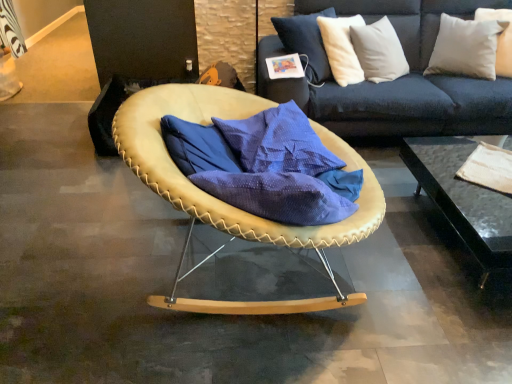
Where is `white soft pillow at upper right, the 1th pillow viewed from the right`? white soft pillow at upper right, the 1th pillow viewed from the right is located at coordinates (500, 38).

What do you see at coordinates (466, 47) in the screenshot?
I see `white cotton pillow at upper right, arranged as the first pillow when viewed from the left` at bounding box center [466, 47].

Locate an element on the screen. This screenshot has height=384, width=512. black glass table at lower right is located at coordinates (463, 199).

Where is `chair located on the left of white soft pillow at upper right, placed as the 2th pillow when sorted from left to right`? The height and width of the screenshot is (384, 512). chair located on the left of white soft pillow at upper right, placed as the 2th pillow when sorted from left to right is located at coordinates (228, 204).

Is white soft pillow at upper right, the 1th pillow viewed from the right, shorter than leather-like tan chair at center?

Indeed, white soft pillow at upper right, the 1th pillow viewed from the right, has a lesser height compared to leather-like tan chair at center.

Is white soft pillow at upper right, placed as the 2th pillow when sorted from left to right, oriented away from leather-like tan chair at center?

white soft pillow at upper right, placed as the 2th pillow when sorted from left to right, does not have its back to leather-like tan chair at center.

Would you say leather-like tan chair at center is part of white soft pillow at upper right, placed as the 2th pillow when sorted from left to right,'s contents?

No.

From a real-world perspective, is white soft pillow at upper right, the 1th pillow viewed from the right, over black glass table at lower right?

Yes, from a real-world perspective, white soft pillow at upper right, the 1th pillow viewed from the right, is on top of black glass table at lower right.

Is white soft pillow at upper right, placed as the 2th pillow when sorted from left to right, shorter than black glass table at lower right?

Incorrect, the height of white soft pillow at upper right, placed as the 2th pillow when sorted from left to right, does not fall short of that of black glass table at lower right.

Considering the positions of objects white soft pillow at upper right, placed as the 2th pillow when sorted from left to right, and black glass table at lower right in the image provided, who is more to the left, white soft pillow at upper right, placed as the 2th pillow when sorted from left to right, or black glass table at lower right?

black glass table at lower right is more to the left.

Considering the points (484, 11) and (501, 251), which point is behind, point (484, 11) or point (501, 251)?

The point (484, 11) is farther.

Does white soft pillow at upper right, the 1th pillow viewed from the right, have a smaller size compared to white cotton pillow at upper right, arranged as the 2th pillow when viewed from the right?

Correct, white soft pillow at upper right, the 1th pillow viewed from the right, occupies less space than white cotton pillow at upper right, arranged as the 2th pillow when viewed from the right.

From the image's perspective, who appears lower, white soft pillow at upper right, the 1th pillow viewed from the right, or white cotton pillow at upper right, arranged as the 2th pillow when viewed from the right?

From the image's view, white cotton pillow at upper right, arranged as the 2th pillow when viewed from the right, is below.

Which object is wider, white soft pillow at upper right, the 1th pillow viewed from the right, or white cotton pillow at upper right, arranged as the 2th pillow when viewed from the right?

white soft pillow at upper right, the 1th pillow viewed from the right.

Measure the distance from white soft pillow at upper right, placed as the 2th pillow when sorted from left to right, to white cotton pillow at upper right, arranged as the 2th pillow when viewed from the right.

white soft pillow at upper right, placed as the 2th pillow when sorted from left to right, is 7.39 inches from white cotton pillow at upper right, arranged as the 2th pillow when viewed from the right.

How different are the orientations of leather-like tan chair at center and white cotton pillow at upper right, arranged as the 2th pillow when viewed from the right, in degrees?

The facing directions of leather-like tan chair at center and white cotton pillow at upper right, arranged as the 2th pillow when viewed from the right, are 130 degrees apart.

From the picture: Considering the sizes of leather-like tan chair at center and white cotton pillow at upper right, arranged as the first pillow when viewed from the left, in the image, is leather-like tan chair at center wider or thinner than white cotton pillow at upper right, arranged as the first pillow when viewed from the left,?

In the image, leather-like tan chair at center appears to be wider than white cotton pillow at upper right, arranged as the first pillow when viewed from the left.

Considering the sizes of objects leather-like tan chair at center and white cotton pillow at upper right, arranged as the first pillow when viewed from the left, in the image provided, who is smaller, leather-like tan chair at center or white cotton pillow at upper right, arranged as the first pillow when viewed from the left,?

white cotton pillow at upper right, arranged as the first pillow when viewed from the left, is smaller.

Which of these two, black glass table at lower right or leather-like tan chair at center, is thinner?

leather-like tan chair at center is thinner.

Is leather-like tan chair at center surrounded by black glass table at lower right?

No, leather-like tan chair at center is not surrounded by black glass table at lower right.

Which of these two, black glass table at lower right or leather-like tan chair at center, stands shorter?

With less height is black glass table at lower right.

From a real-world perspective, is white cotton pillow at upper right, arranged as the 2th pillow when viewed from the right, physically located above or below leather-like tan chair at center?

From a real-world perspective, white cotton pillow at upper right, arranged as the 2th pillow when viewed from the right, is physically above leather-like tan chair at center.

Locate an element on the screen. chair that is under the white cotton pillow at upper right, arranged as the first pillow when viewed from the left (from a real-world perspective) is located at coordinates (228, 204).

Looking at this image, considering the relative sizes of white cotton pillow at upper right, arranged as the 2th pillow when viewed from the right, and leather-like tan chair at center in the image provided, is white cotton pillow at upper right, arranged as the 2th pillow when viewed from the right, shorter than leather-like tan chair at center?

Indeed, white cotton pillow at upper right, arranged as the 2th pillow when viewed from the right, has a lesser height compared to leather-like tan chair at center.

Is white cotton pillow at upper right, arranged as the first pillow when viewed from the left, thinner than white soft pillow at upper right, placed as the 2th pillow when sorted from left to right?

Correct, the width of white cotton pillow at upper right, arranged as the first pillow when viewed from the left, is less than that of white soft pillow at upper right, placed as the 2th pillow when sorted from left to right.

Is white cotton pillow at upper right, arranged as the 2th pillow when viewed from the right, completely or partially outside of white soft pillow at upper right, placed as the 2th pillow when sorted from left to right?

white cotton pillow at upper right, arranged as the 2th pillow when viewed from the right, is positioned outside white soft pillow at upper right, placed as the 2th pillow when sorted from left to right.

Considering the relative positions of white cotton pillow at upper right, arranged as the 2th pillow when viewed from the right, and white soft pillow at upper right, the 1th pillow viewed from the right, in the image provided, is white cotton pillow at upper right, arranged as the 2th pillow when viewed from the right, to the left or to the right of white soft pillow at upper right, the 1th pillow viewed from the right,?

white cotton pillow at upper right, arranged as the 2th pillow when viewed from the right, is positioned on white soft pillow at upper right, the 1th pillow viewed from the right,'s left side.

Considering the relative sizes of white cotton pillow at upper right, arranged as the 2th pillow when viewed from the right, and white soft pillow at upper right, the 1th pillow viewed from the right, in the image provided, is white cotton pillow at upper right, arranged as the 2th pillow when viewed from the right, shorter than white soft pillow at upper right, the 1th pillow viewed from the right,?

Incorrect, the height of white cotton pillow at upper right, arranged as the 2th pillow when viewed from the right, does not fall short of that of white soft pillow at upper right, the 1th pillow viewed from the right.

Where is `pillow that is the 2nd one when counting backward from the leather-like tan chair at center`? The height and width of the screenshot is (384, 512). pillow that is the 2nd one when counting backward from the leather-like tan chair at center is located at coordinates (500, 38).

There is a black glass table at lower right. Find the location of `the 2nd pillow above it (from the image's perspective)`. the 2nd pillow above it (from the image's perspective) is located at coordinates (500, 38).

From the image, which object appears to be farther from white cotton pillow at upper right, arranged as the first pillow when viewed from the left, leather-like tan chair at center or leather-like beige chair at center?

leather-like tan chair at center is positioned further to the anchor white cotton pillow at upper right, arranged as the first pillow when viewed from the left.

Considering their positions, is leather-like beige chair at center positioned further to leather-like tan chair at center than white soft pillow at upper right, placed as the 2th pillow when sorted from left to right?

The object further to leather-like tan chair at center is white soft pillow at upper right, placed as the 2th pillow when sorted from left to right.

Considering their positions, is black glass table at lower right positioned further to white soft pillow at upper right, the 1th pillow viewed from the right, than white cotton pillow at upper right, arranged as the 2th pillow when viewed from the right?

black glass table at lower right lies further to white soft pillow at upper right, the 1th pillow viewed from the right, than the other object.

Based on their spatial positions, is white cotton pillow at upper right, arranged as the 2th pillow when viewed from the right, or white soft pillow at upper right, placed as the 2th pillow when sorted from left to right, closer to black glass table at lower right?

white cotton pillow at upper right, arranged as the 2th pillow when viewed from the right, lies closer to black glass table at lower right than the other object.

When comparing their distances from white cotton pillow at upper right, arranged as the first pillow when viewed from the left, does black glass table at lower right or leather-like beige chair at center seem closer?

black glass table at lower right is closer to white cotton pillow at upper right, arranged as the first pillow when viewed from the left.

Consider the image. Considering their positions, is leather-like tan chair at center positioned further to white cotton pillow at upper right, arranged as the 2th pillow when viewed from the right, than black glass table at lower right?

Among the two, leather-like tan chair at center is located further to white cotton pillow at upper right, arranged as the 2th pillow when viewed from the right.

Estimate the real-world distances between objects in this image. Which object is further from white soft pillow at upper right, the 1th pillow viewed from the right, white cotton pillow at upper right, arranged as the 2th pillow when viewed from the right, or leather-like tan chair at center?

The object further to white soft pillow at upper right, the 1th pillow viewed from the right, is leather-like tan chair at center.

Based on the photo, considering their positions, is leather-like tan chair at center positioned closer to black glass table at lower right than white soft pillow at upper right, placed as the 2th pillow when sorted from left to right?

Based on the image, white soft pillow at upper right, placed as the 2th pillow when sorted from left to right, appears to be nearer to black glass table at lower right.

The height and width of the screenshot is (384, 512). In order to click on table between leather-like tan chair at center and white cotton pillow at upper right, arranged as the 2th pillow when viewed from the right, in the horizontal direction in this screenshot , I will do `click(463, 199)`.

At what (x,y) coordinates should I click in order to perform the action: click on table located between leather-like beige chair at center and white soft pillow at upper right, the 1th pillow viewed from the right, in the left-right direction. Please return your answer as a coordinate pair (x, y). Looking at the image, I should click on (463, 199).

Locate an element on the screen. The width and height of the screenshot is (512, 384). chair between leather-like beige chair at center and black glass table at lower right in the horizontal direction is located at coordinates (228, 204).

At what (x,y) coordinates should I click in order to perform the action: click on chair between leather-like beige chair at center and white cotton pillow at upper right, arranged as the first pillow when viewed from the left, in the horizontal direction. Please return your answer as a coordinate pair (x, y). The width and height of the screenshot is (512, 384). Looking at the image, I should click on (228, 204).